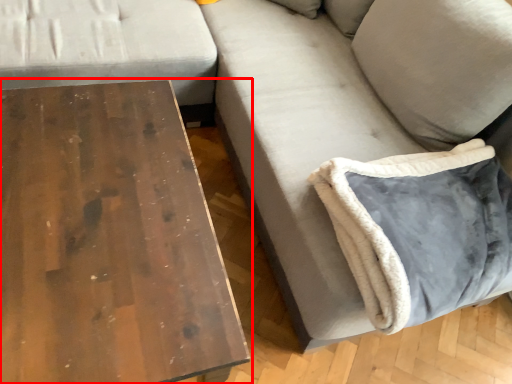
Question: From the image's perspective, where is table (annotated by the red box) located in relation to pillow in the image?

Choices:
 (A) below
 (B) above

Answer: (A)